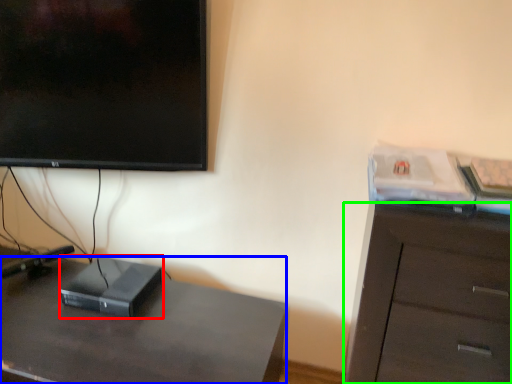
Question: Which object is positioned closest to computer (highlighted by a red box)? Select from desk (highlighted by a blue box) and cabinetry (highlighted by a green box).

Choices:
 (A) desk
 (B) cabinetry

Answer: (A)